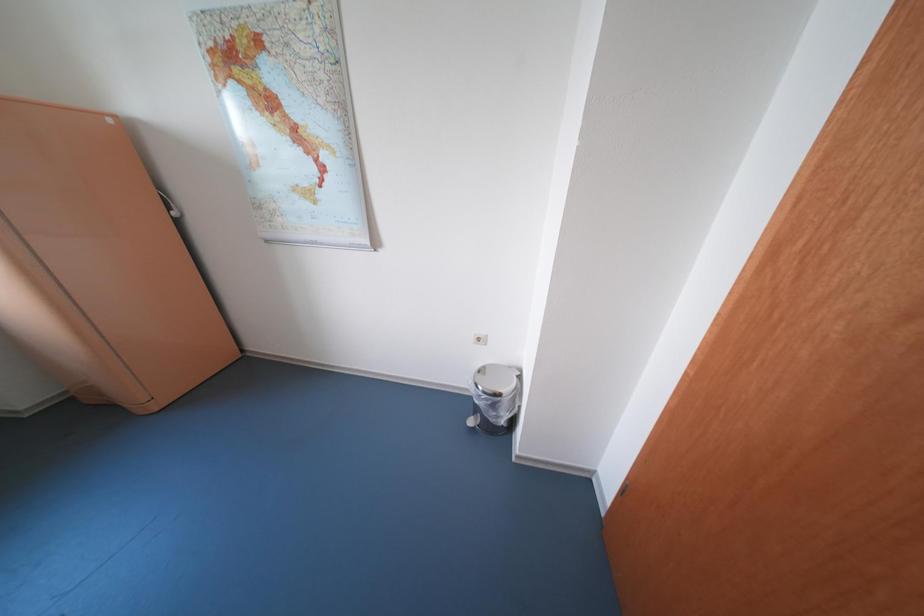
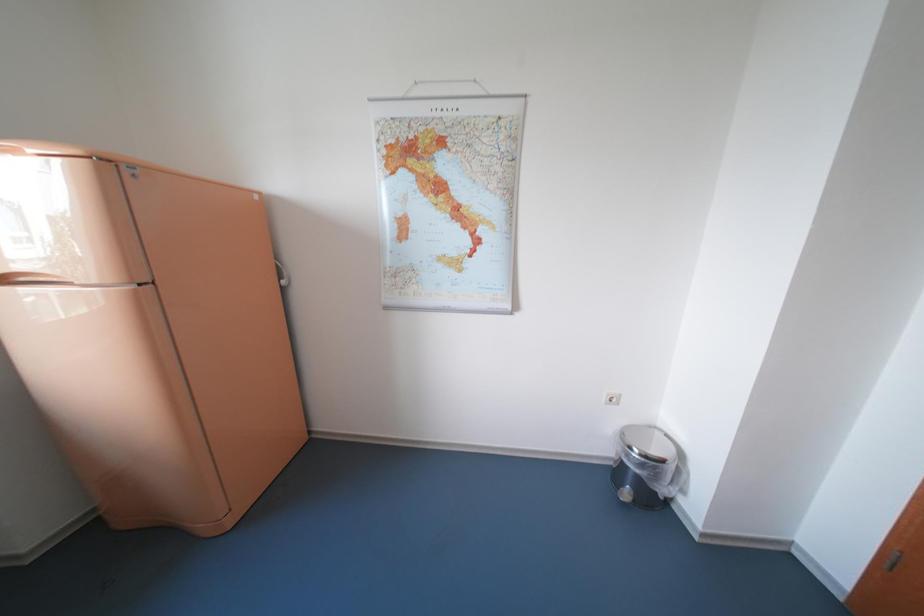
Question: The images are taken continuously from a first-person perspective. In which direction is your viewpoint rotating?

Choices:
 (A) Left
 (B) Right
 (C) Up
 (D) Down

Answer: (C)